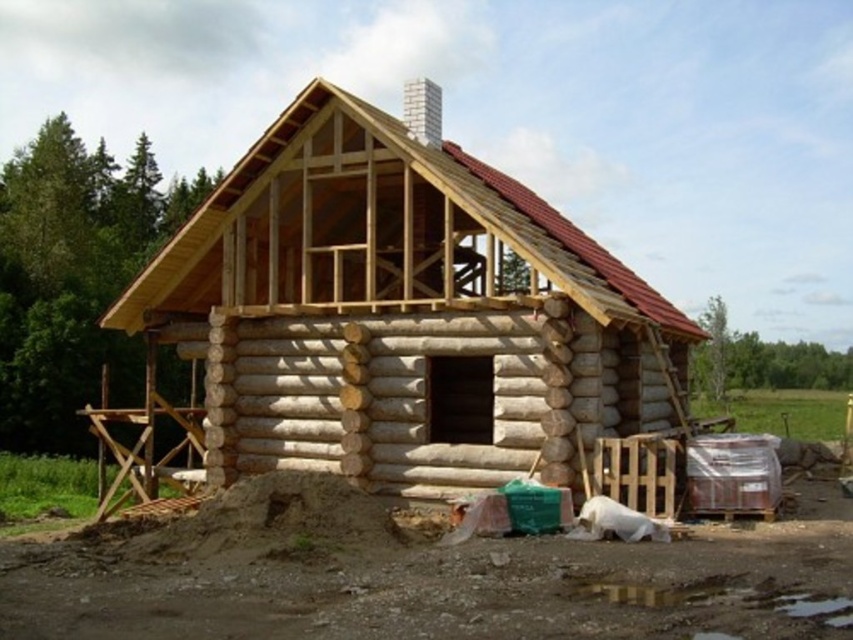
Does natural wood log cabin at center appear on the right side of brown dirt field at lower center?

Correct, you'll find natural wood log cabin at center to the right of brown dirt field at lower center.

Describe the element at coordinates (401, 314) in the screenshot. The height and width of the screenshot is (640, 853). I see `natural wood log cabin at center` at that location.

The height and width of the screenshot is (640, 853). Find the location of `natural wood log cabin at center`. natural wood log cabin at center is located at coordinates (401, 314).